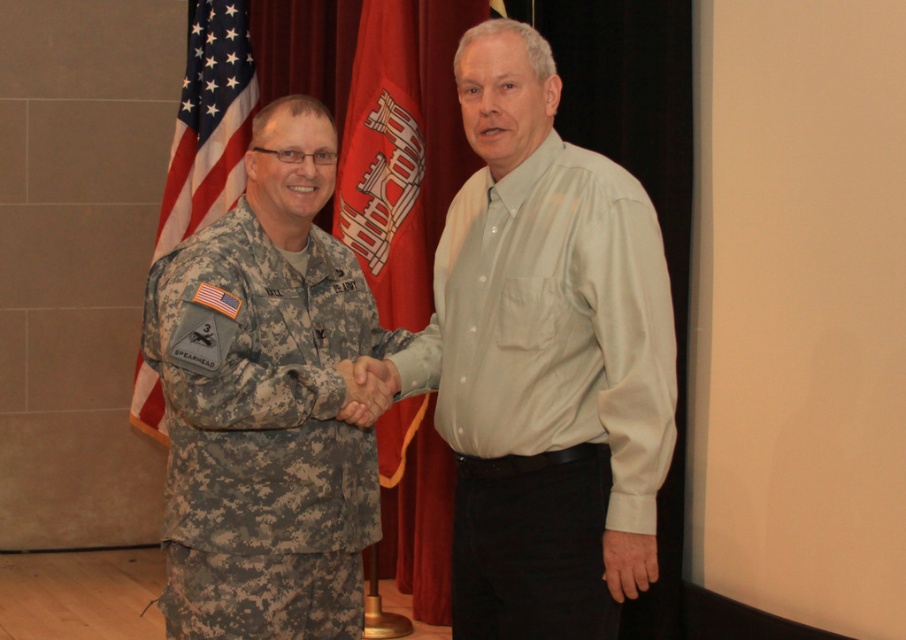
Who is positioned more to the left, light gray cotton shirt at right or red fabric flag at center?

From the viewer's perspective, red fabric flag at center appears more on the left side.

At what (x,y) coordinates should I click in order to perform the action: click on light gray cotton shirt at right. Please return your answer as a coordinate pair (x, y). The width and height of the screenshot is (906, 640). Looking at the image, I should click on (556, 328).

Where is `light gray cotton shirt at right`? light gray cotton shirt at right is located at coordinates (556, 328).

Which of these two, camouflage fabric uniform at left or red fabric flag at center, stands shorter?

Standing shorter between the two is camouflage fabric uniform at left.

Who is more distant from viewer, (229, 419) or (444, 524)?

The point (444, 524) is more distant.

Locate an element on the screen. This screenshot has width=906, height=640. camouflage fabric uniform at left is located at coordinates (262, 433).

Between point (306, 616) and point (237, 173), which one is positioned behind?

Positioned behind is point (237, 173).

Is point (174, 561) more distant than point (191, 148)?

No, it is in front of (191, 148).

I want to click on camouflage fabric uniform at left, so click(x=262, y=433).

The width and height of the screenshot is (906, 640). Find the location of `camouflage fabric uniform at left`. camouflage fabric uniform at left is located at coordinates (262, 433).